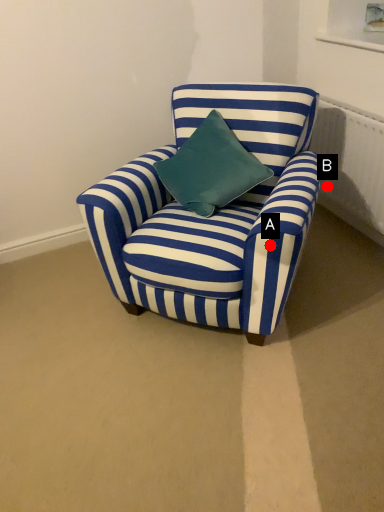
Question: Two points are circled on the image, labeled by A and B beside each circle. Which point is farther to the camera?

Choices:
 (A) A is further
 (B) B is further

Answer: (B)